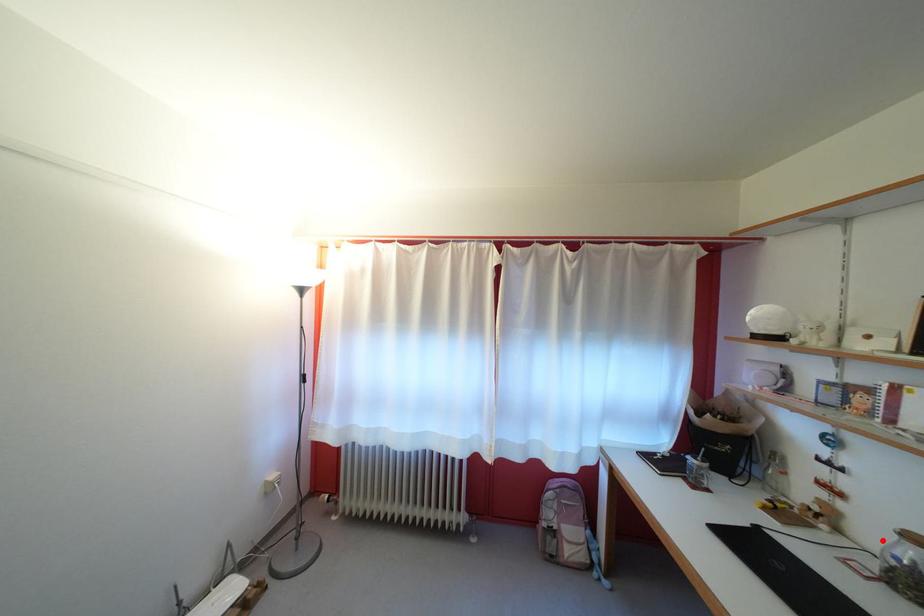
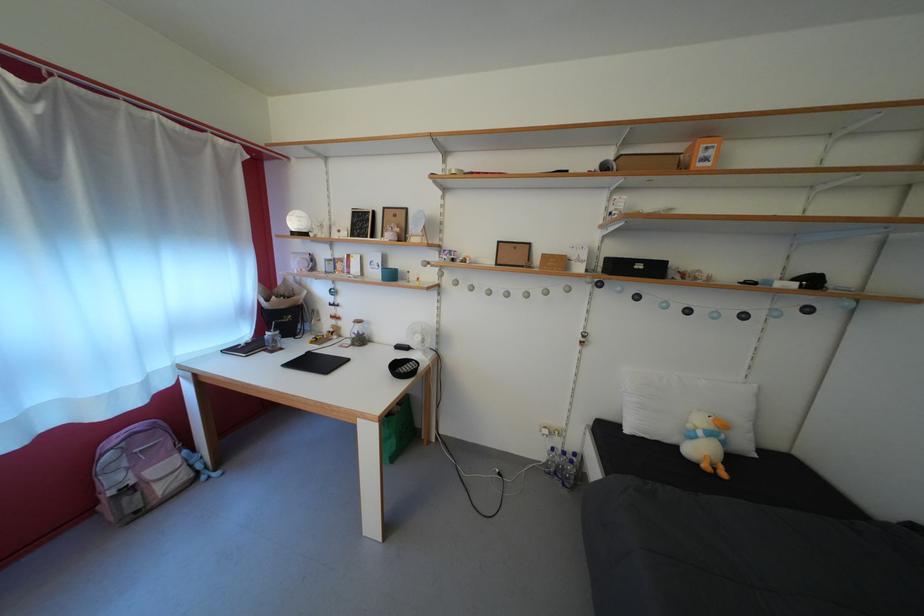
Question: I am providing you with two images of the same scene from different viewpoints. A red point is marked on the first image. Is the red point's position out of view in image 2?

Choices:
 (A) Yes
 (B) No

Answer: (B)